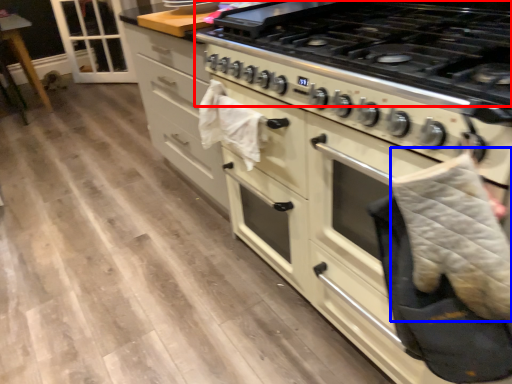
Question: Among these objects, which one is nearest to the camera, gas stove (highlighted by a red box) or blanket (highlighted by a blue box)?

Choices:
 (A) gas stove
 (B) blanket

Answer: (B)